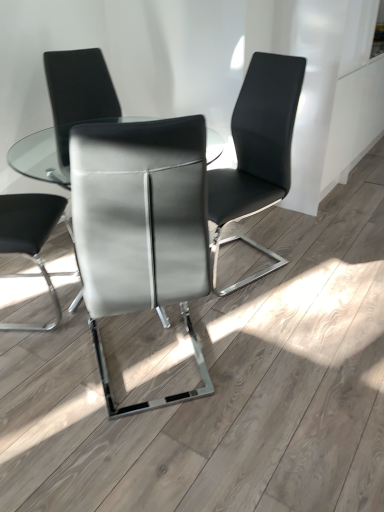
I want to click on vacant area that is situated to the right of satin gray leather chair at center, placed as the 2th chair when sorted from left to right, so click(259, 361).